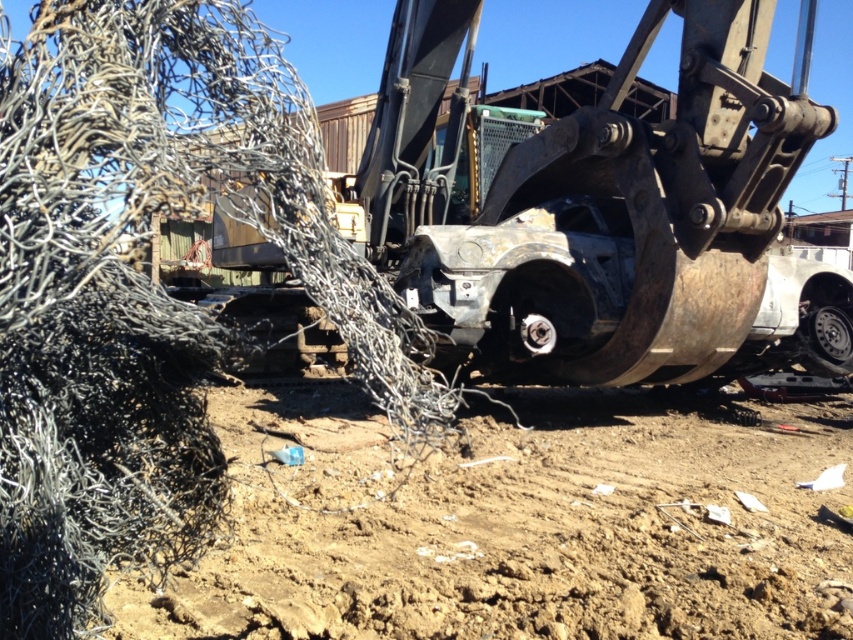
Which is in front, point (772, 481) or point (842, 369)?

Positioned in front is point (772, 481).

Does brown soil at lower center have a smaller size compared to black rubber tire at lower right?

Incorrect, brown soil at lower center is not smaller in size than black rubber tire at lower right.

Is point (621, 468) farther from camera compared to point (839, 317)?

No.

This screenshot has width=853, height=640. Identify the location of brown soil at lower center. (517, 524).